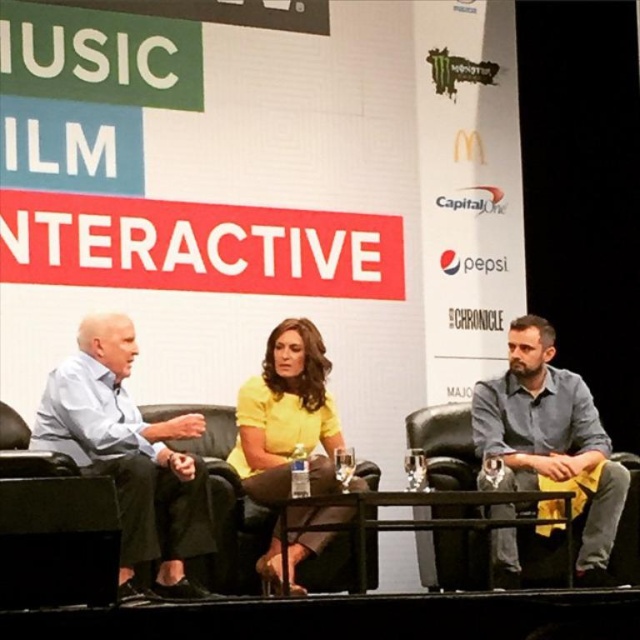
You are organizing a panel discussion and need to ensure that all participants have enough space between their chairs. The chairs are arranged in a straight line. The gray cotton shirt at right and the yellow matte shirt at center are seated next to each other. Which participant should you move to create more space between the two chairs?

You should move the gray cotton shirt at right because its width is larger than the yellow matte shirt at center, so adjusting their positions based on their size will help create more space between the chairs.

What is located at the point with coordinates (550, 436) in the image?

The gray cotton shirt at right is located at the point with coordinates (550, 436).